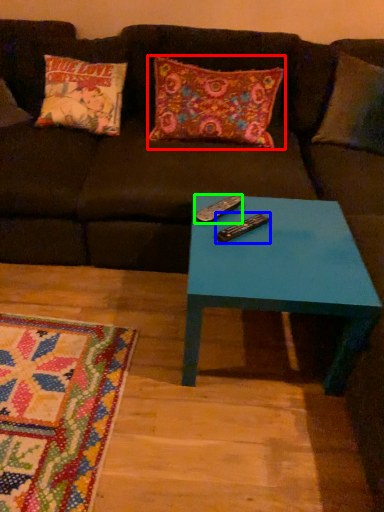
Question: Which object is positioned closest to pillow (highlighted by a red box)? Select from remote (highlighted by a blue box) and remote (highlighted by a green box).

Choices:
 (A) remote
 (B) remote

Answer: (B)